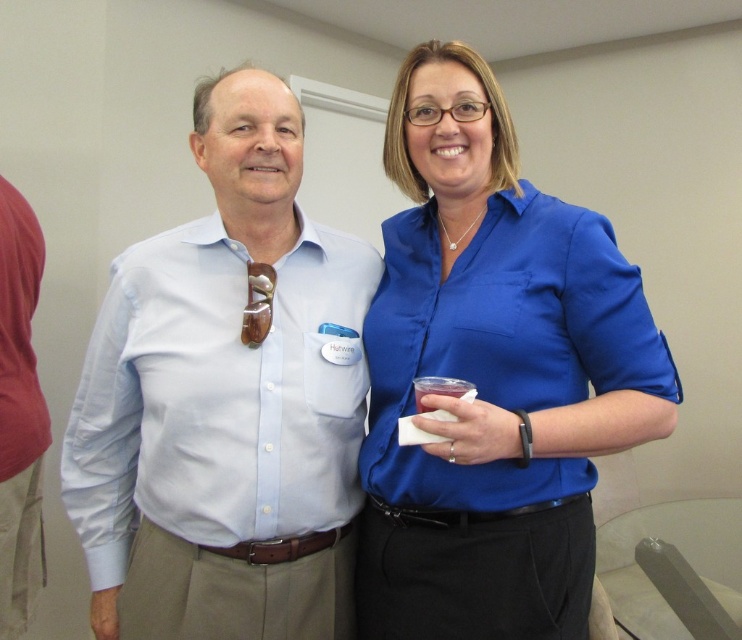
Question: Which point is farther from the camera taking this photo?

Choices:
 (A) (114, 429)
 (B) (380, 598)

Answer: (A)

Question: Is blue satin blouse at center to the left of light blue cotton shirt at center from the viewer's perspective?

Choices:
 (A) no
 (B) yes

Answer: (A)

Question: Is blue satin blouse at center bigger than light blue cotton shirt at center?

Choices:
 (A) yes
 (B) no

Answer: (A)

Question: Which object appears farthest from the camera in this image?

Choices:
 (A) light blue cotton shirt at center
 (B) blue satin blouse at center

Answer: (A)

Question: In this image, where is blue satin blouse at center located relative to light blue cotton shirt at center?

Choices:
 (A) left
 (B) right

Answer: (B)